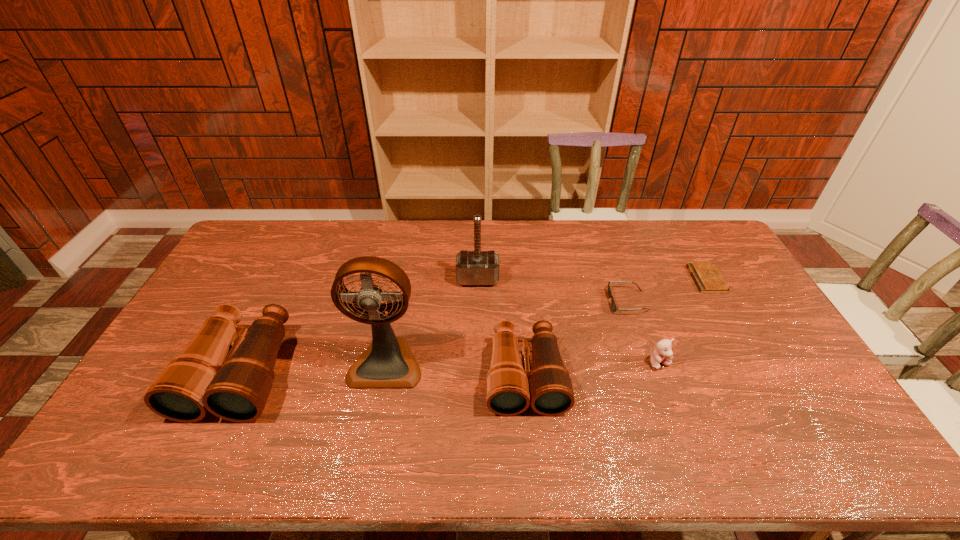
Locate an element on the screen. The height and width of the screenshot is (540, 960). the leftmost object is located at coordinates (202, 378).

Locate an element on the screen. the taller binoculars is located at coordinates (202, 378).

This screenshot has height=540, width=960. Find the location of `the shorter binoculars`. the shorter binoculars is located at coordinates (508, 385).

Identify the location of the right binoculars. (508, 385).

Locate an element on the screen. Image resolution: width=960 pixels, height=540 pixels. diary is located at coordinates (707, 277).

Identify the location of the shortest object. The width and height of the screenshot is (960, 540). (707, 277).

Where is `sunglasses`? The height and width of the screenshot is (540, 960). sunglasses is located at coordinates (614, 306).

Locate an element on the screen. The width and height of the screenshot is (960, 540). the third shortest object is located at coordinates (663, 354).

The image size is (960, 540). What are the coordinates of `the second tallest object` in the screenshot? It's located at (477, 267).

Locate an element on the screen. fan is located at coordinates click(388, 362).